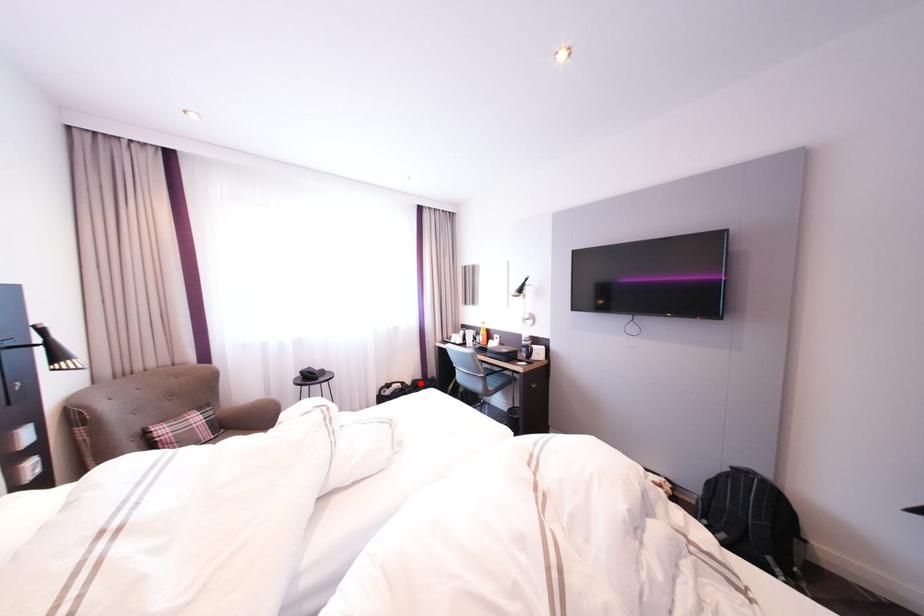
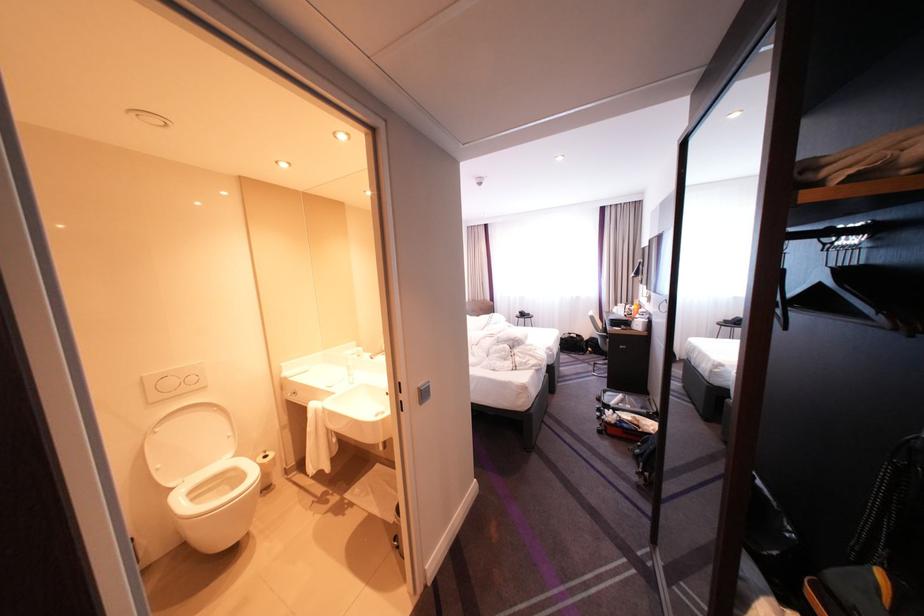
Question: I am providing you with two images of the same scene from different viewpoints. A red point is shown in image1. For the corresponding object point in image2, is it positioned nearer or farther from the camera?

Choices:
 (A) Nearer
 (B) Farther

Answer: (A)